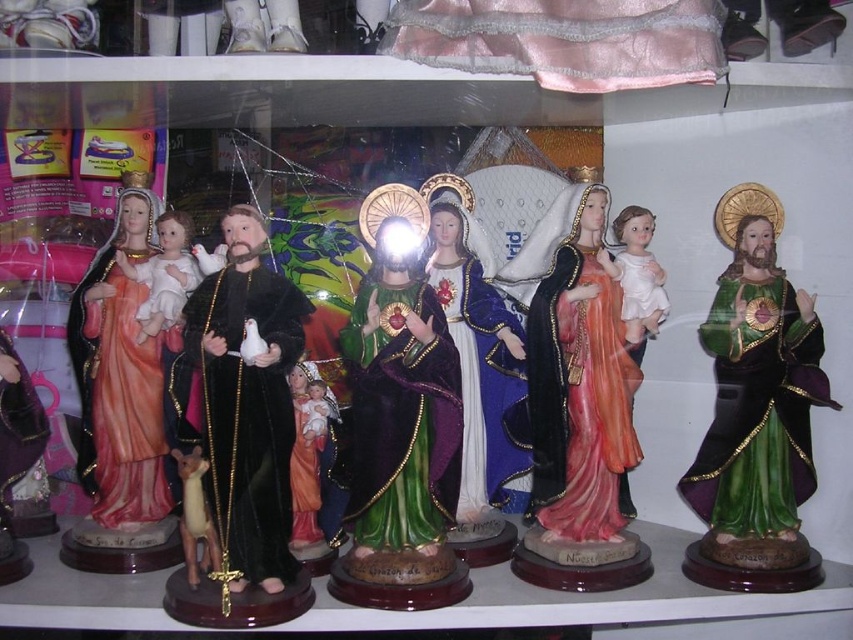
Question: Does matte porcelain baby at center appear over brown plush dog at center?

Choices:
 (A) yes
 (B) no

Answer: (A)

Question: Estimate the real-world distances between objects in this image. Which object is farther from the white glossy baby doll at center?

Choices:
 (A) velvet black statue at center
 (B) green glossy statue at center
 (C) matte porcelain baby at center
 (D) green glossy statue at right

Answer: (A)

Question: Which of these objects is positioned farthest from the brown plush dog at center?

Choices:
 (A) matte porcelain baby at center
 (B) green glossy statue at center
 (C) white glossy baby doll at center
 (D) green glossy statue at right

Answer: (D)

Question: Does matte porcelain doll at left appear on the right side of shiny purple statue at center?

Choices:
 (A) yes
 (B) no

Answer: (B)

Question: Can you confirm if green glossy statue at right is positioned to the right of green glossy statue at center?

Choices:
 (A) no
 (B) yes

Answer: (B)

Question: Which object is positioned closest to the matte orange fabric statue at center?

Choices:
 (A) green glossy statue at center
 (B) white glossy baby doll at center
 (C) velvet black statue at center

Answer: (B)